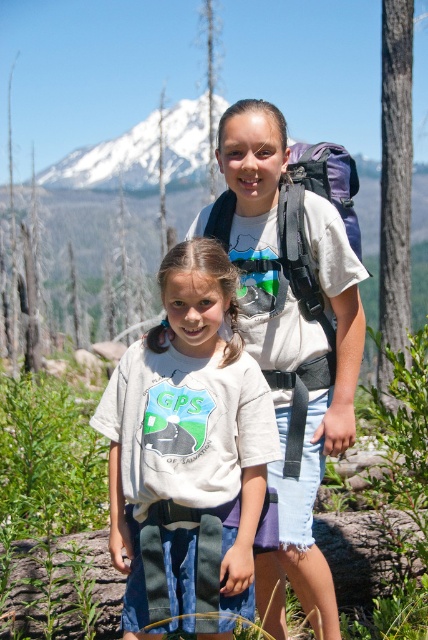
Question: Which point appears closest to the camera in this image?

Choices:
 (A) (272, 468)
 (B) (146, 531)
 (C) (130, 141)

Answer: (B)

Question: Observing the image, what is the correct spatial positioning of white matte backpack at center in reference to snowy peak at upper center?

Choices:
 (A) right
 (B) left

Answer: (A)

Question: Is white cotton shirt at center positioned behind white matte backpack at center?

Choices:
 (A) yes
 (B) no

Answer: (B)

Question: Among these points, which one is farthest from the camera?

Choices:
 (A) (323, 211)
 (B) (151, 122)
 (C) (247, 433)

Answer: (B)

Question: Which object is the closest to the white cotton shirt at center?

Choices:
 (A) snowy peak at upper center
 (B) white matte backpack at center

Answer: (B)

Question: Can you confirm if white cotton shirt at center is positioned below snowy peak at upper center?

Choices:
 (A) yes
 (B) no

Answer: (A)